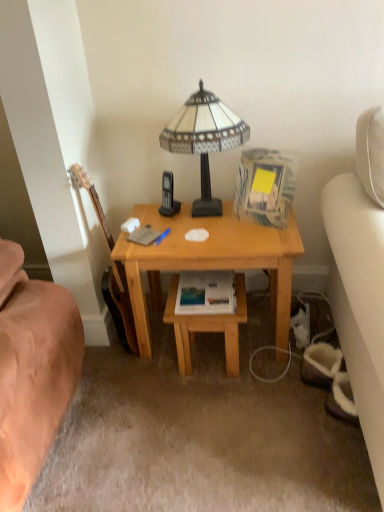
The width and height of the screenshot is (384, 512). Find the location of `vacant area that lies in front of light brown wood table at center`. vacant area that lies in front of light brown wood table at center is located at coordinates (224, 407).